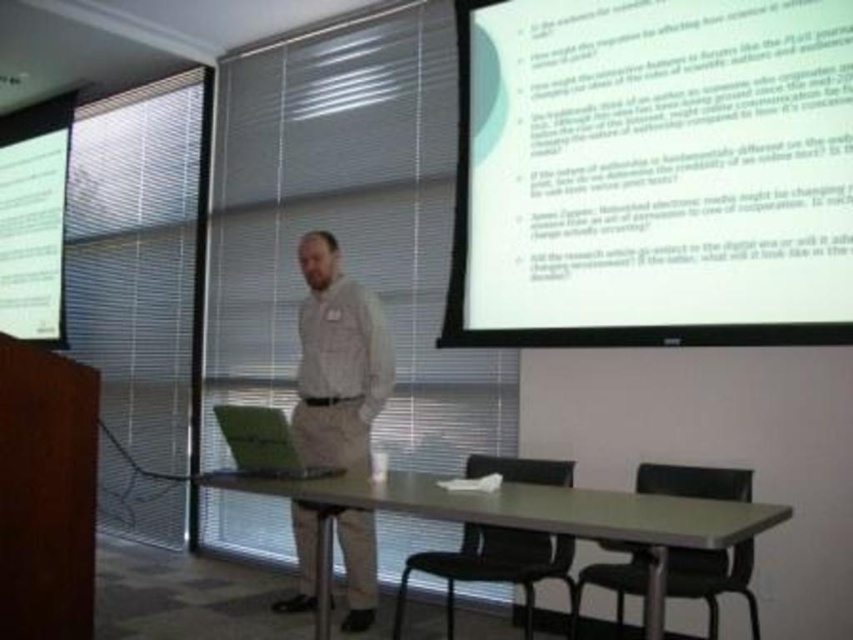
Question: Estimate the real-world distances between objects in this image. Which object is farther from the metallic gray table at center?

Choices:
 (A) light beige shirt at center
 (B) white glossy projector screen at upper right

Answer: (B)

Question: Does white glossy projector screen at upper right have a larger size compared to metallic gray table at center?

Choices:
 (A) no
 (B) yes

Answer: (B)

Question: Which object is closer to the camera taking this photo?

Choices:
 (A) white glossy projector screen at upper right
 (B) metallic gray table at center
 (C) light beige shirt at center
 (D) green matte laptop at center

Answer: (B)

Question: Does light beige shirt at center appear under green matte laptop at center?

Choices:
 (A) no
 (B) yes

Answer: (B)

Question: Which point appears farthest from the camera in this image?

Choices:
 (A) (315, 262)
 (B) (611, 108)

Answer: (A)

Question: Is white glossy projector screen at upper right below green matte laptop at center?

Choices:
 (A) no
 (B) yes

Answer: (A)